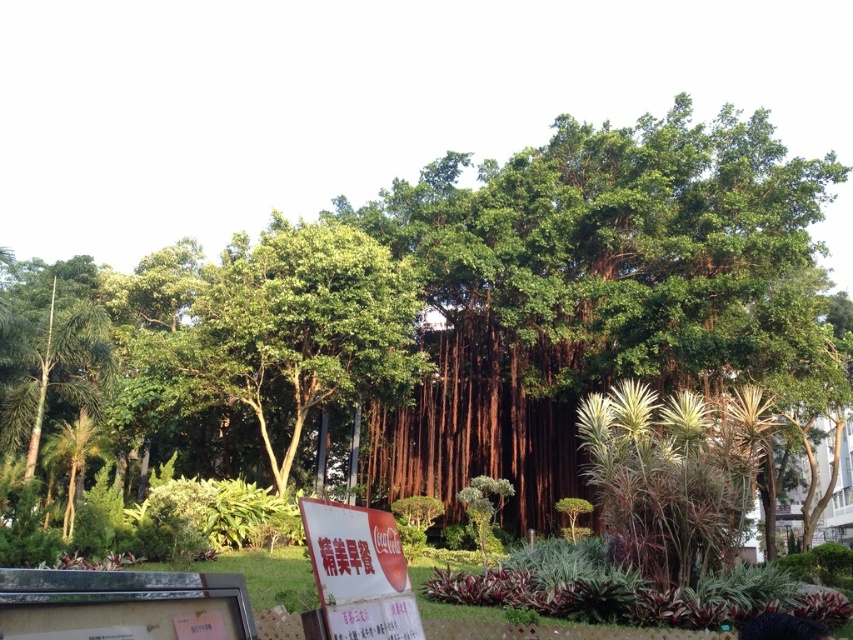
Who is higher up, green leafy banyan tree at center or white paper sign at lower center?

Positioned higher is green leafy banyan tree at center.

What do you see at coordinates (593, 289) in the screenshot? This screenshot has width=853, height=640. I see `green leafy banyan tree at center` at bounding box center [593, 289].

Is point (434, 474) farther from viewer compared to point (354, 588)?

Yes, point (434, 474) is farther from viewer.

This screenshot has height=640, width=853. Find the location of `green leafy banyan tree at center`. green leafy banyan tree at center is located at coordinates (593, 289).